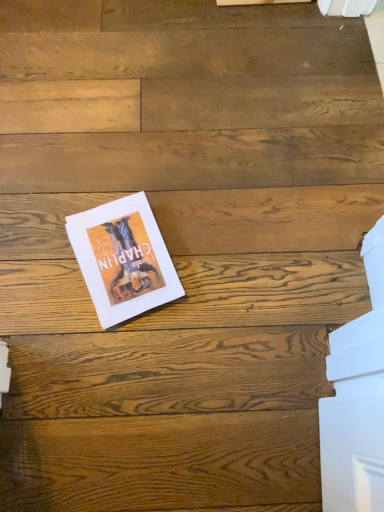
Identify the location of vacant region to the left of white paper book at center. This screenshot has height=512, width=384. (33, 249).